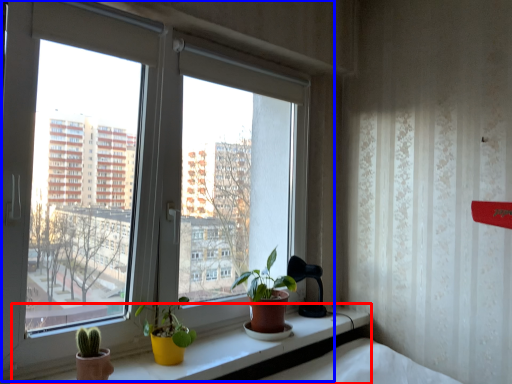
Question: Which object is further to the camera taking this photo, window sill (highlighted by a red box) or window (highlighted by a blue box)?

Choices:
 (A) window sill
 (B) window

Answer: (B)